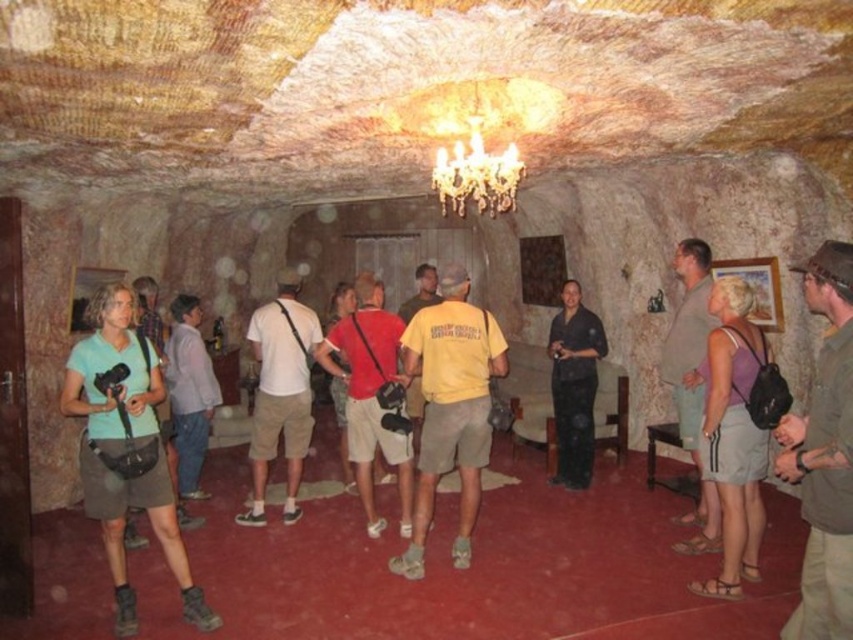
You are standing in the cave and want to move from the point at (x=426, y=486) to the point at (x=750, y=476). Which direction should you move to get closer to your destination?

To move from point at (x=426, y=486) to point at (x=750, y=476), you should move upward because point at (x=426, y=486) is further away from the camera compared to point at (x=750, y=476), which is closer. Moving upward would bring you closer to the destination.

You are standing in the cave and want to hand a gift to both the person wearing the yellow cotton shirt at center and the person wearing the purple fabric tank top at center. Which person should you approach first to ensure you can reach them without moving closer to the cave wall?

You should approach the yellow cotton shirt at center first because it is closer to you than the purple fabric tank top at center, so you can reach them without needing to move closer to the cave wall.

Looking at this image, you are a photographer standing in the cave. You notice two people wearing the green fabric shirt at center and the matte red shirt at center. Which person is standing closer to the ceiling?

The green fabric shirt at center is shorter than the matte red shirt at center, so the person wearing the green fabric shirt at center is closer to the ceiling since they are shorter.